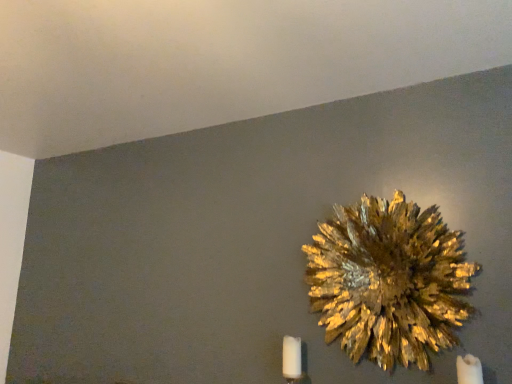
Question: Does gold textured flower at upper right lie behind white matte candle at lower right, the 2th candle positioned from the front?

Choices:
 (A) no
 (B) yes

Answer: (A)

Question: Is the surface of gold textured flower at upper right in direct contact with white matte candle at lower right, acting as the 2th candle starting from the right?

Choices:
 (A) no
 (B) yes

Answer: (A)

Question: From a real-world perspective, is gold textured flower at upper right located higher than white matte candle at lower right, acting as the 2th candle starting from the right?

Choices:
 (A) yes
 (B) no

Answer: (A)

Question: Is white matte candle at lower right, the 2th candle positioned from the front, a part of gold textured flower at upper right?

Choices:
 (A) yes
 (B) no

Answer: (B)

Question: Would you say gold textured flower at upper right is outside white matte candle at lower right, positioned as the 1th candle in left-to-right order?

Choices:
 (A) no
 (B) yes

Answer: (B)

Question: Considering their positions, is white matte candle at lower right, the second candle from the back, located in front of or behind gold textured flower at upper right?

Choices:
 (A) behind
 (B) front

Answer: (B)

Question: Looking at their shapes, would you say white matte candle at lower right, arranged as the first candle when viewed from the right, is wider or thinner than gold textured flower at upper right?

Choices:
 (A) wide
 (B) thin

Answer: (A)

Question: Do you think white matte candle at lower right, arranged as the first candle when viewed from the right, is within gold textured flower at upper right, or outside of it?

Choices:
 (A) outside
 (B) inside

Answer: (A)

Question: Is point (471, 370) closer or farther from the camera than point (352, 344)?

Choices:
 (A) closer
 (B) farther

Answer: (A)

Question: Would you say white matte candle at lower right, acting as the 1th candle starting from the back, is to the left or to the right of white matte candle at lower right, arranged as the 2th candle when viewed from the left, in the picture?

Choices:
 (A) right
 (B) left

Answer: (B)

Question: Looking at the image, does white matte candle at lower right, acting as the 1th candle starting from the back, seem bigger or smaller compared to white matte candle at lower right, the first candle in the front-to-back sequence?

Choices:
 (A) big
 (B) small

Answer: (B)

Question: Relative to white matte candle at lower right, arranged as the first candle when viewed from the right, is white matte candle at lower right, acting as the 1th candle starting from the back, in front or behind?

Choices:
 (A) front
 (B) behind

Answer: (B)

Question: Is point (283, 375) positioned closer to the camera than point (471, 357)?

Choices:
 (A) farther
 (B) closer

Answer: (A)

Question: Looking at the image, does gold textured flower at upper right seem bigger or smaller compared to white matte candle at lower right, arranged as the 2th candle when viewed from the left?

Choices:
 (A) small
 (B) big

Answer: (B)

Question: Is gold textured flower at upper right spatially inside white matte candle at lower right, arranged as the 2th candle when viewed from the left, or outside of it?

Choices:
 (A) outside
 (B) inside

Answer: (A)